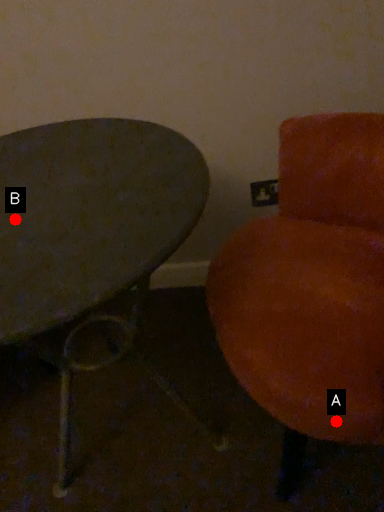
Question: Two points are circled on the image, labeled by A and B beside each circle. Which point appears closest to the camera in this image?

Choices:
 (A) A is closer
 (B) B is closer

Answer: (B)